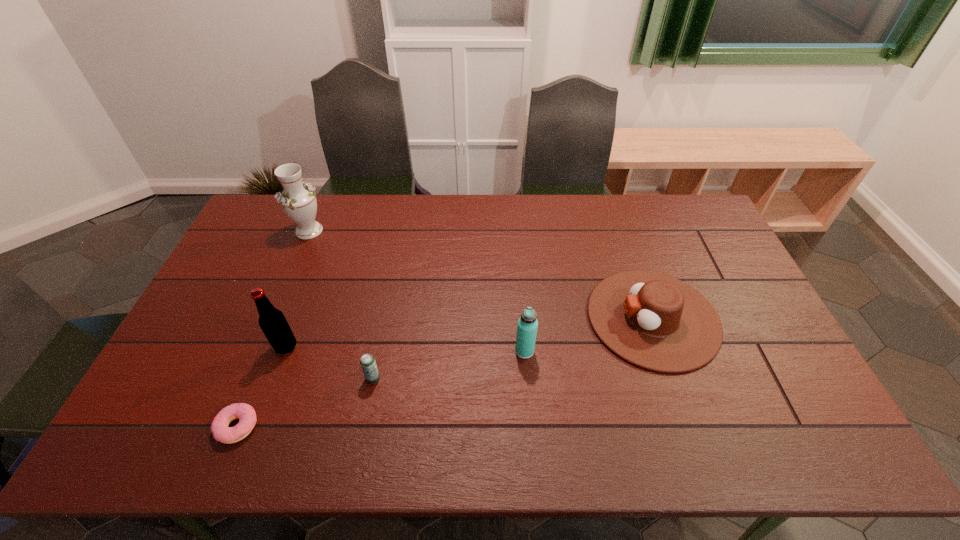
Identify the location of object located at the right edge. The height and width of the screenshot is (540, 960). (652, 320).

Find the location of a particular element. Image resolution: width=960 pixels, height=540 pixels. object present at the far left corner is located at coordinates (298, 201).

In the image, there is a desktop. Identify the location of free space at the far edge. This screenshot has width=960, height=540. (603, 229).

Locate an element on the screen. vacant space at the right edge is located at coordinates (685, 249).

The width and height of the screenshot is (960, 540). In the image, there is a desktop. In order to click on vacant area at the near left corner in this screenshot , I will do `click(162, 442)`.

The height and width of the screenshot is (540, 960). What are the coordinates of `free space at the far right corner` in the screenshot? It's located at (701, 212).

Locate an element on the screen. Image resolution: width=960 pixels, height=540 pixels. blank region between the cowboy hat and the farthest object is located at coordinates (481, 274).

Where is `free point between the beer bottle and the fourth object from left to right`? free point between the beer bottle and the fourth object from left to right is located at coordinates (329, 363).

Locate an element on the screen. This screenshot has height=540, width=960. free area in between the shortest object and the beer bottle is located at coordinates point(261,387).

The image size is (960, 540). I want to click on free space between the doughnut and the beer bottle, so click(261, 387).